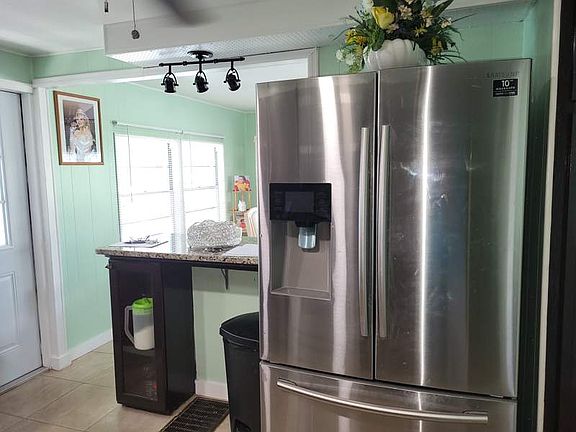
This screenshot has width=576, height=432. I want to click on pictures, so click(242, 183), click(242, 220).